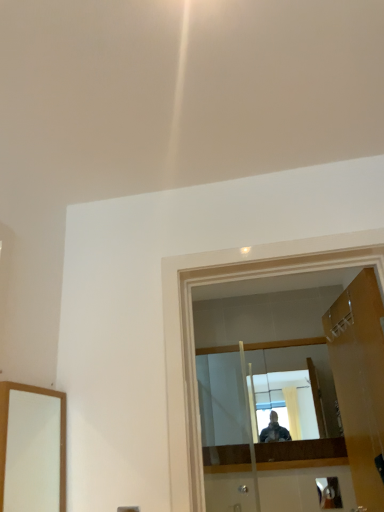
Question: Does wooden door at right have a greater height compared to metallic silver door handle at lower right?

Choices:
 (A) no
 (B) yes

Answer: (B)

Question: Is metallic silver door handle at lower right located within wooden door at right?

Choices:
 (A) no
 (B) yes

Answer: (A)

Question: Can you confirm if wooden door at right is bigger than metallic silver door handle at lower right?

Choices:
 (A) yes
 (B) no

Answer: (A)

Question: Considering the relative positions of wooden door at right and metallic silver door handle at lower right in the image provided, is wooden door at right to the right of metallic silver door handle at lower right from the viewer's perspective?

Choices:
 (A) no
 (B) yes

Answer: (A)

Question: Can you confirm if wooden door at right is smaller than metallic silver door handle at lower right?

Choices:
 (A) yes
 (B) no

Answer: (B)

Question: Is wooden door at right to the left of metallic silver door handle at lower right from the viewer's perspective?

Choices:
 (A) no
 (B) yes

Answer: (B)

Question: Does metallic silver door handle at lower right have a greater height compared to transparent glass door at center?

Choices:
 (A) yes
 (B) no

Answer: (B)

Question: Can you confirm if metallic silver door handle at lower right is smaller than transparent glass door at center?

Choices:
 (A) no
 (B) yes

Answer: (B)

Question: Is metallic silver door handle at lower right shorter than transparent glass door at center?

Choices:
 (A) no
 (B) yes

Answer: (B)

Question: Are metallic silver door handle at lower right and transparent glass door at center located far from each other?

Choices:
 (A) no
 (B) yes

Answer: (B)

Question: Is metallic silver door handle at lower right completely or partially outside of transparent glass door at center?

Choices:
 (A) yes
 (B) no

Answer: (A)

Question: Is metallic silver door handle at lower right looking in the opposite direction of transparent glass door at center?

Choices:
 (A) no
 (B) yes

Answer: (A)

Question: Can you confirm if transparent glass door at center is positioned to the right of wooden door at right?

Choices:
 (A) no
 (B) yes

Answer: (A)